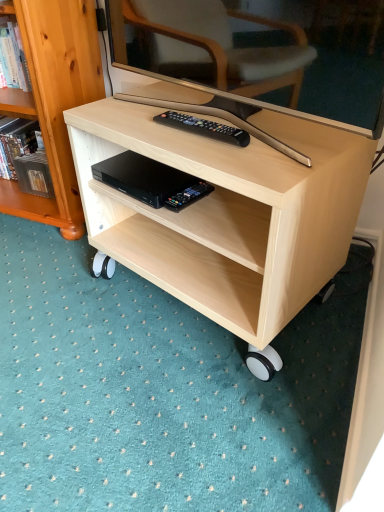
You are a GUI agent. You are given a task and a screenshot of the screen. Output one action in this format:
    pyautogui.click(x=<x>, y=<y>)
    Task: Click on the free space to the left of black plastic remote at center
    Image resolution: width=384 pixels, height=512 pixels.
    Given the screenshot: What is the action you would take?
    pyautogui.click(x=139, y=128)